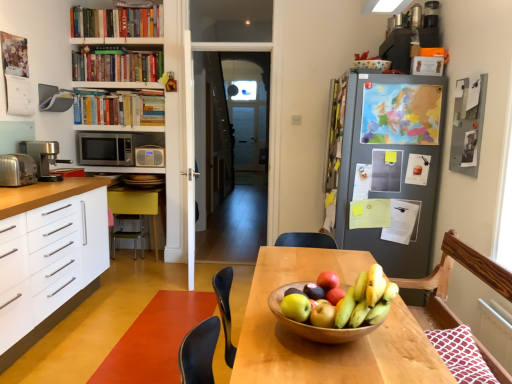
I want to click on vacant area on top of wooden bowl of fruit at center (from a real-world perspective), so click(x=324, y=298).